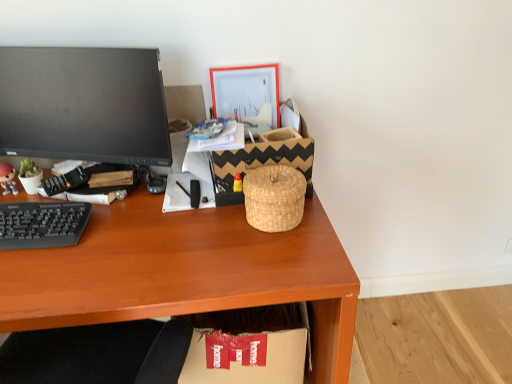
At what (x,y) coordinates should I click in order to perform the action: click on empty space that is ontop of black plastic keyboard at left (from a real-world perspective). Please return your answer as a coordinate pair (x, y). Looking at the image, I should click on (33, 223).